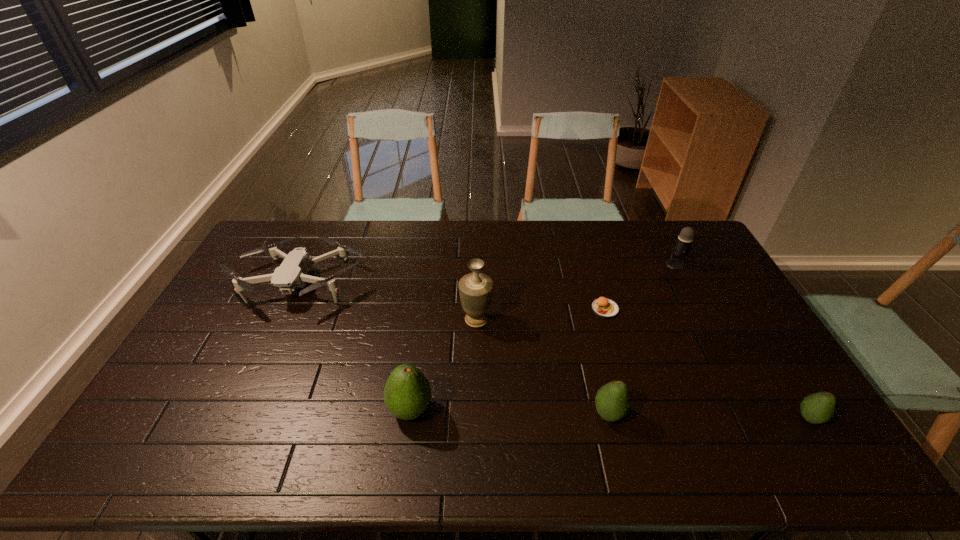
In order to click on free space between the drone and the rightmost object in this screenshot , I will do click(554, 350).

Where is `free space that is in between the leftmost avocado and the microphone`? free space that is in between the leftmost avocado and the microphone is located at coordinates (543, 337).

Find the location of a particular element. The height and width of the screenshot is (540, 960). empty location between the shortest object and the fifth object from right to left is located at coordinates (540, 314).

In order to click on empty space between the leftmost object and the sixth object from left to right in this screenshot , I will do point(487,273).

Find the location of a particular element. free space between the leftmost object and the second object from right to left is located at coordinates (487, 273).

At what (x,y) coordinates should I click in order to perform the action: click on free spot between the patty and the rightmost object. Please return your answer as a coordinate pair (x, y). Image resolution: width=960 pixels, height=540 pixels. Looking at the image, I should click on (708, 363).

This screenshot has height=540, width=960. I want to click on free space between the sixth object from left to right and the rightmost object, so click(742, 341).

Locate an element on the screen. object that stands as the fourth closest to the drone is located at coordinates (603, 307).

Select which object is the closest to the second avocado from left to right. Please provide its 2D coordinates. Your answer should be formatted as a tuple, i.e. [(x, y)], where the tuple contains the x and y coordinates of a point satisfying the conditions above.

[(603, 307)]

Identify which avocado is the second nearest to the sixth object from left to right. Please provide its 2D coordinates. Your answer should be formatted as a tuple, i.e. [(x, y)], where the tuple contains the x and y coordinates of a point satisfying the conditions above.

[(612, 402)]